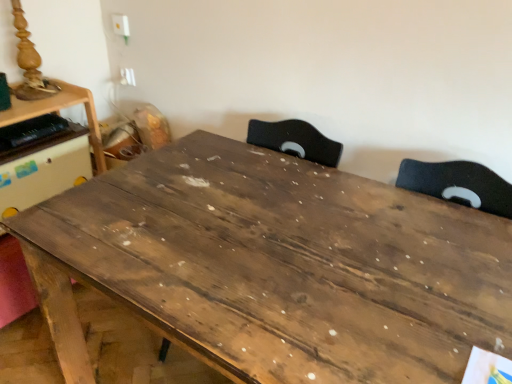
Image resolution: width=512 pixels, height=384 pixels. I want to click on vacant space situated above wooden table at center, acting as the second table starting from the left (from a real-world perspective), so click(289, 240).